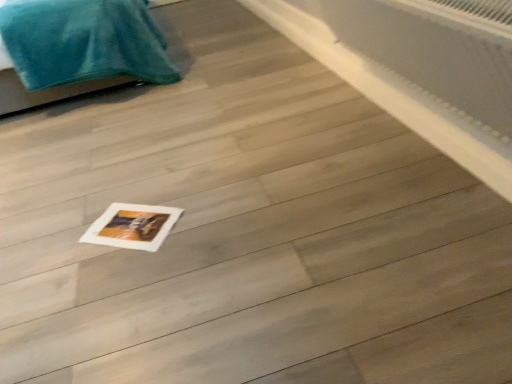
This screenshot has height=384, width=512. Find the location of `vacant space in white glossy magazine at center (from a real-world perspective)`. vacant space in white glossy magazine at center (from a real-world perspective) is located at coordinates pos(133,226).